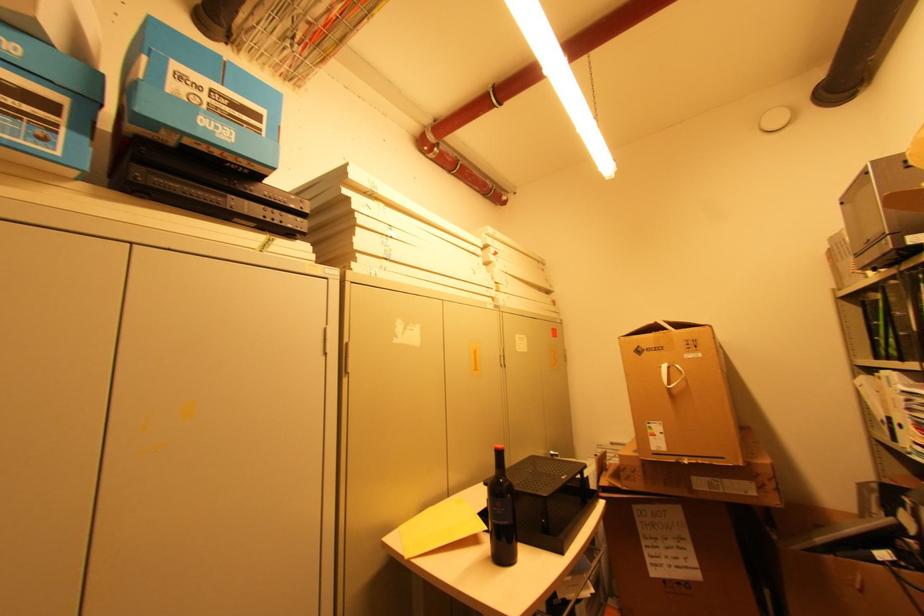
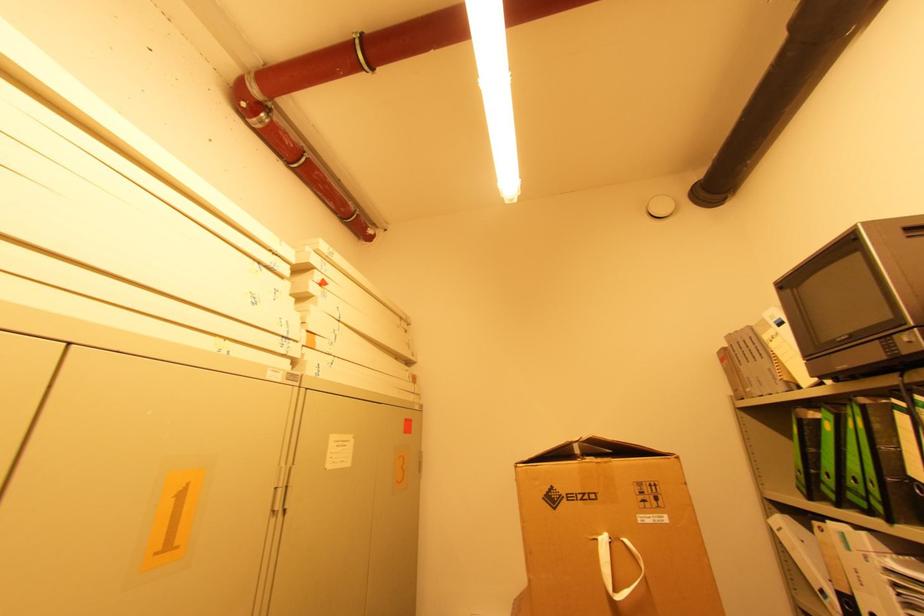
Find the pixel in the second image that matches point 881,341 in the first image.

(822, 476)